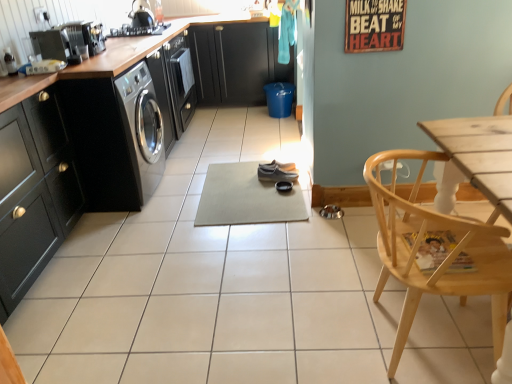
Question: Can you confirm if light wood chair at lower right is bigger than shiny black kettle at upper left?

Choices:
 (A) yes
 (B) no

Answer: (A)

Question: Is shiny black kettle at upper left at the back of light wood chair at lower right?

Choices:
 (A) no
 (B) yes

Answer: (A)

Question: From a real-world perspective, is light wood chair at lower right positioned under shiny black kettle at upper left based on gravity?

Choices:
 (A) yes
 (B) no

Answer: (A)

Question: Is light wood chair at lower right surrounding shiny black kettle at upper left?

Choices:
 (A) yes
 (B) no

Answer: (B)

Question: Does light wood chair at lower right lie behind shiny black kettle at upper left?

Choices:
 (A) yes
 (B) no

Answer: (B)

Question: Is the surface of light wood chair at lower right in direct contact with shiny black kettle at upper left?

Choices:
 (A) yes
 (B) no

Answer: (B)

Question: Is matte black cabinets at center, which is the 1th cabinetry from back to front, oriented towards metallic silver toaster at upper left?

Choices:
 (A) no
 (B) yes

Answer: (B)

Question: From the image's perspective, is matte black cabinets at center, positioned as the 1th cabinetry in top-to-bottom order, located above metallic silver toaster at upper left?

Choices:
 (A) yes
 (B) no

Answer: (A)

Question: Can you confirm if matte black cabinets at center, positioned as the 1th cabinetry in top-to-bottom order, is thinner than metallic silver toaster at upper left?

Choices:
 (A) no
 (B) yes

Answer: (A)

Question: Is matte black cabinets at center, positioned as the 1th cabinetry in top-to-bottom order, shorter than metallic silver toaster at upper left?

Choices:
 (A) yes
 (B) no

Answer: (B)

Question: Is matte black cabinets at center, the 1th cabinetry in the right-to-left sequence, at the left side of metallic silver toaster at upper left?

Choices:
 (A) yes
 (B) no

Answer: (B)

Question: From a real-world perspective, is matte black cabinets at center, acting as the second cabinetry starting from the bottom, beneath metallic silver toaster at upper left?

Choices:
 (A) no
 (B) yes

Answer: (B)

Question: Is beige rubber yoga mat at center positioned behind matte black cabinets at center, positioned as the 1th cabinetry in top-to-bottom order?

Choices:
 (A) no
 (B) yes

Answer: (A)